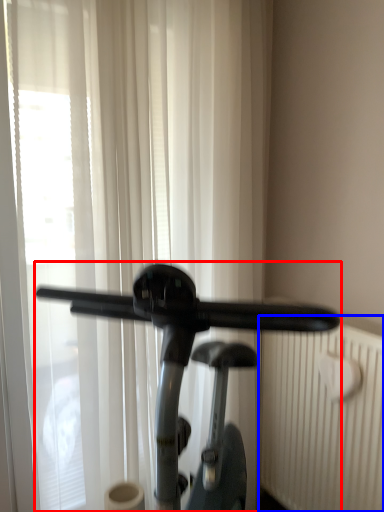
Question: Which of the following is the closest to the observer, stationary bicycle (highlighted by a red box) or radiator (highlighted by a blue box)?

Choices:
 (A) stationary bicycle
 (B) radiator

Answer: (A)